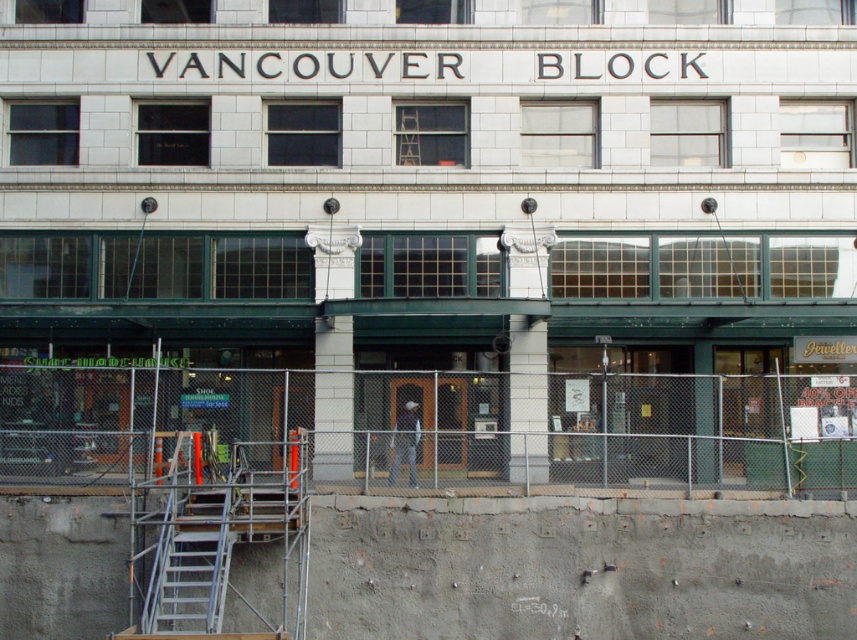
Can you confirm if chain-link fence at center is positioned above dark gray fabric construction worker at center?

Indeed, chain-link fence at center is positioned over dark gray fabric construction worker at center.

Does chain-link fence at center appear on the left side of dark gray fabric construction worker at center?

In fact, chain-link fence at center is to the right of dark gray fabric construction worker at center.

I want to click on chain-link fence at center, so click(x=442, y=426).

Which is more to the right, metal scaffolding at lower left or dark gray fabric construction worker at center?

metal scaffolding at lower left is more to the right.

Can you confirm if metal scaffolding at lower left is positioned below dark gray fabric construction worker at center?

Correct, metal scaffolding at lower left is located below dark gray fabric construction worker at center.

From the picture: Who is more distant from viewer, [220,436] or [405,433]?

The point [220,436] is more distant.

Where is `metal scaffolding at lower left`? This screenshot has height=640, width=857. metal scaffolding at lower left is located at coordinates (591, 531).

Is metallic gray staircase at lower left to the left of dark gray fabric construction worker at center from the viewer's perspective?

Correct, you'll find metallic gray staircase at lower left to the left of dark gray fabric construction worker at center.

Between point (171, 548) and point (393, 476), which one is positioned behind?

The point (393, 476) is behind.

Who is more distant from viewer, (213, 589) or (402, 413)?

The point (402, 413) is behind.

Where is `metallic gray staircase at lower left`? Image resolution: width=857 pixels, height=640 pixels. metallic gray staircase at lower left is located at coordinates (190, 563).